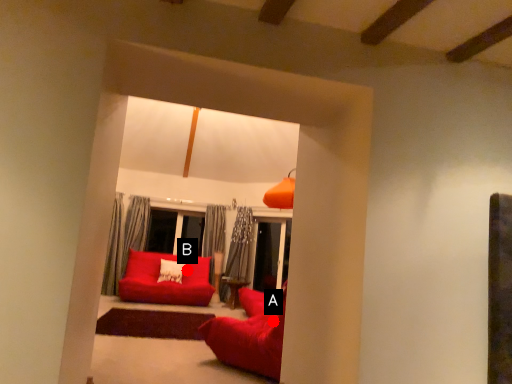
Question: Two points are circled on the image, labeled by A and B beside each circle. Which of the following is the closest to the observer?

Choices:
 (A) A is closer
 (B) B is closer

Answer: (A)